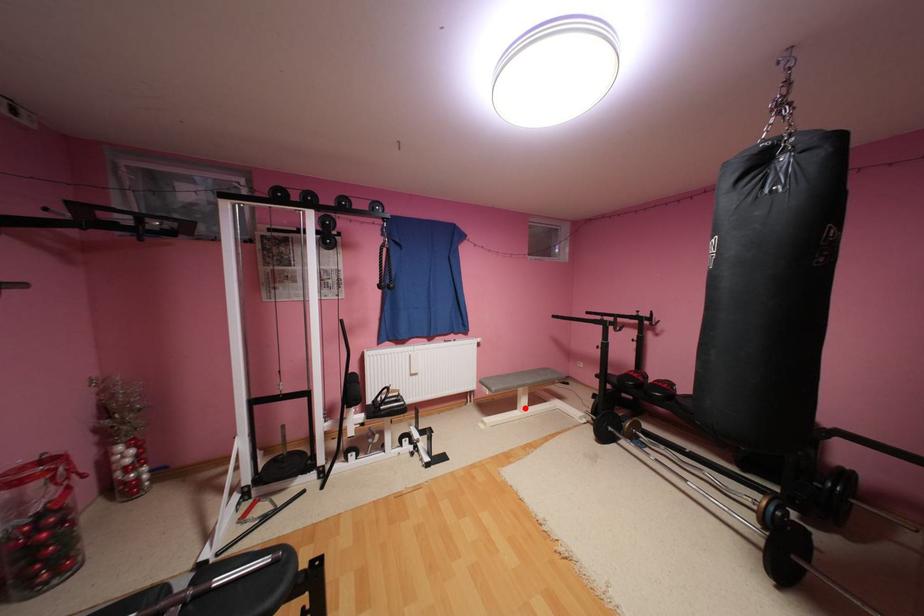
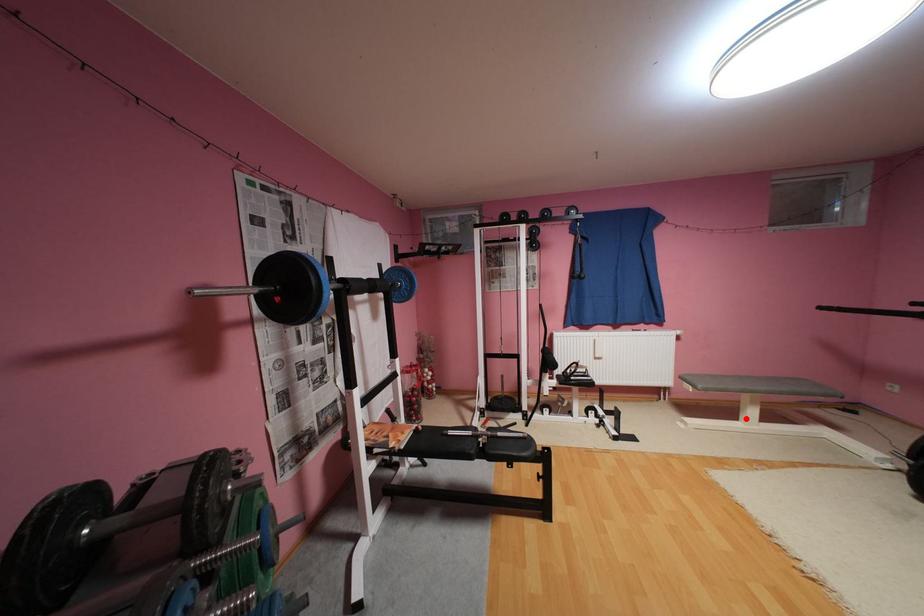
I am providing you with two images of the same scene from different viewpoints. A red point is marked on the first image and another point is marked on the second image. Does the point marked in image1 correspond to the same location as the one in image2?

Yes